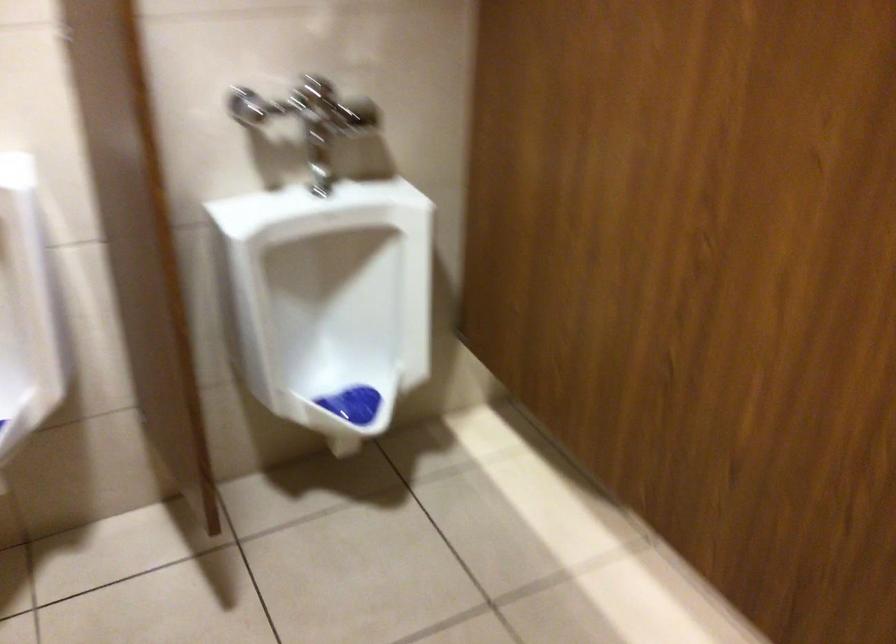
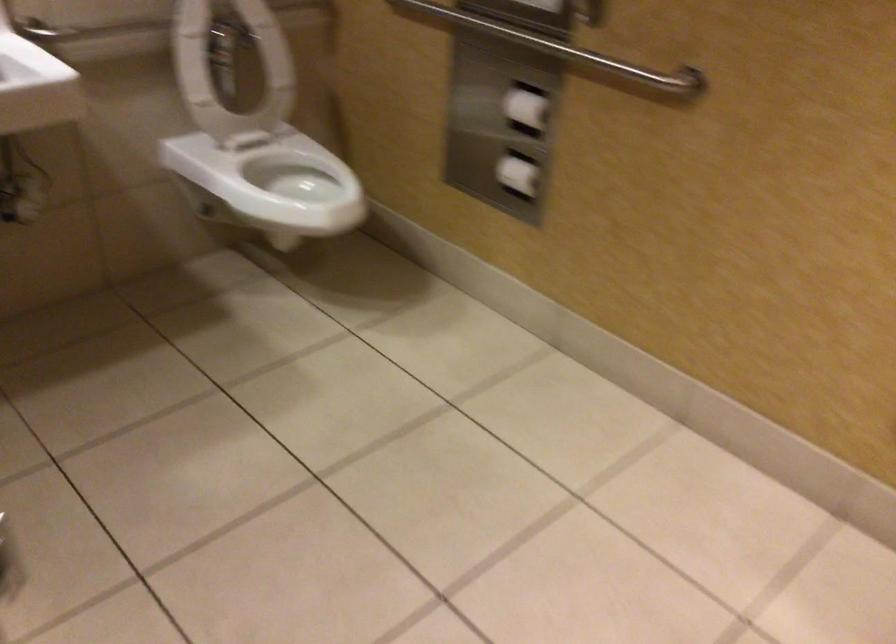
Question: In a continuous first-person perspective shot, in which direction is the camera moving?

Choices:
 (A) Left
 (B) Right
 (C) Forward
 (D) Backward

Answer: (B)